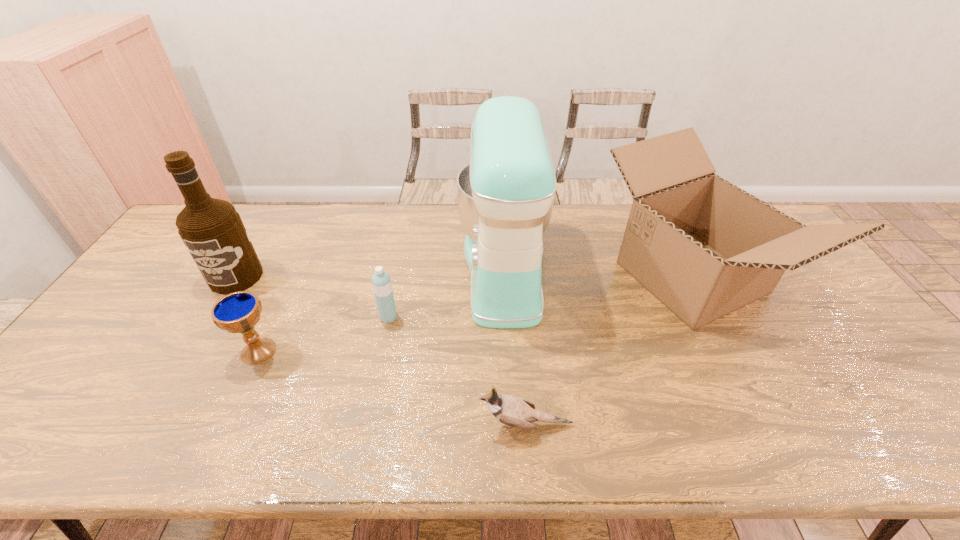
The image size is (960, 540). I want to click on mixer, so click(506, 193).

Find the location of a particular element. alcohol is located at coordinates (212, 230).

Find the location of a particular element. The width and height of the screenshot is (960, 540). the leftmost object is located at coordinates (212, 230).

I want to click on the rightmost object, so click(x=704, y=247).

Where is `box`? box is located at coordinates (704, 247).

Locate an element on the screen. the fourth object from right to left is located at coordinates (381, 282).

Where is `the fifth object from right to left`? The width and height of the screenshot is (960, 540). the fifth object from right to left is located at coordinates pos(238,312).

Locate an element on the screen. Image resolution: width=960 pixels, height=540 pixels. the nearest object is located at coordinates [x=514, y=411].

Identify the location of vacant area situated 0.300m at the base of the mixer. (362, 271).

Identify the location of vacant region located at the base of the mixer. The height and width of the screenshot is (540, 960). (339, 271).